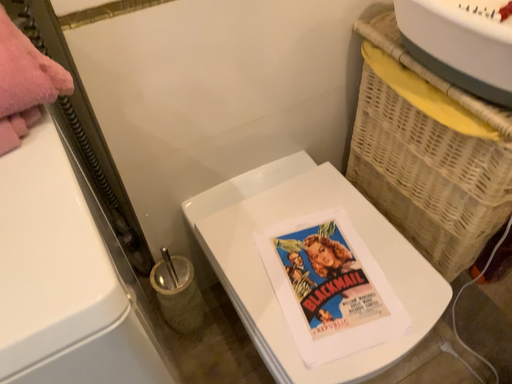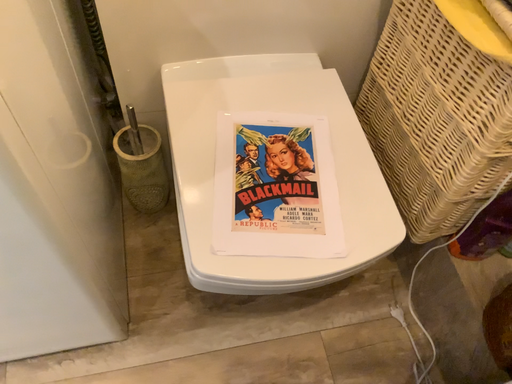
Question: Which way did the camera rotate in the video?

Choices:
 (A) rotated left
 (B) rotated right

Answer: (A)